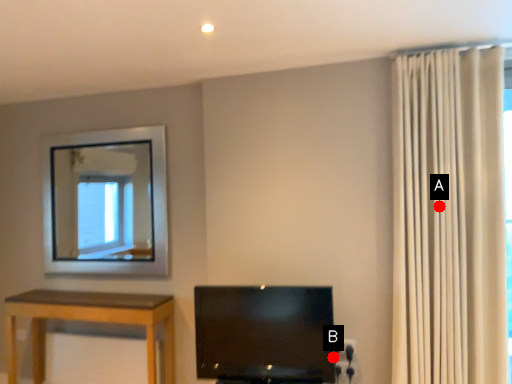
Question: Two points are circled on the image, labeled by A and B beside each circle. Which point is closer to the camera?

Choices:
 (A) A is closer
 (B) B is closer

Answer: (A)